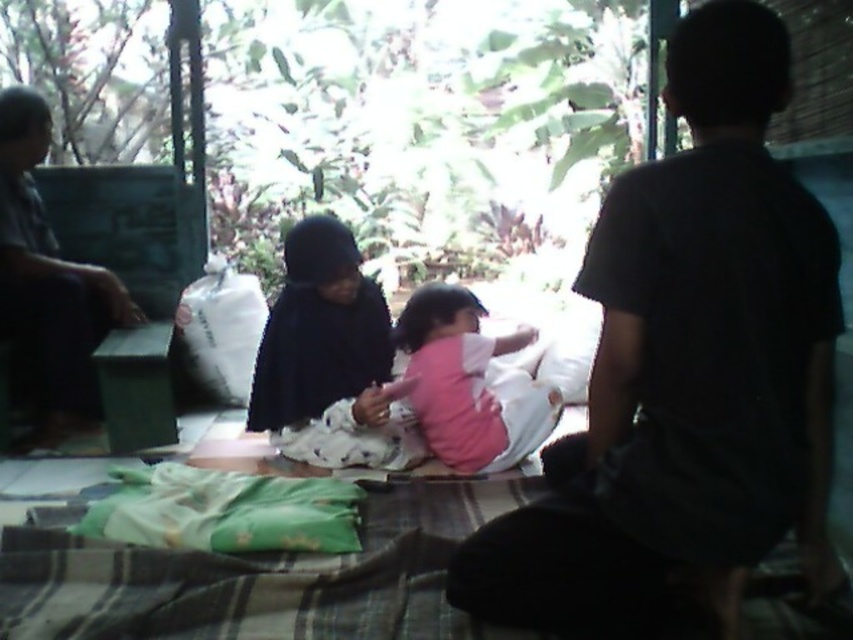
You are a parent trying to ensure your children are spaced appropriately for safety. The recommended distance between children is at least 30 centimeters. Are the children wearing black matte clothing at center and pink matte shirt at center following the safety guidelines?

The distance between the black matte clothing at center and pink matte shirt at center is 26.42 centimeters, which is less than the recommended 30 centimeters. Therefore, they are not following the safety guidelines.

You are organizing a small outdoor event and need to decide which clothing item has a larger size between the black matte clothing at center and the pink matte shirt at center. Based on the scene description, which one should you choose?

The pink matte shirt at center is larger than the black matte clothing at center, so you should choose the pink matte shirt at center for a larger size.